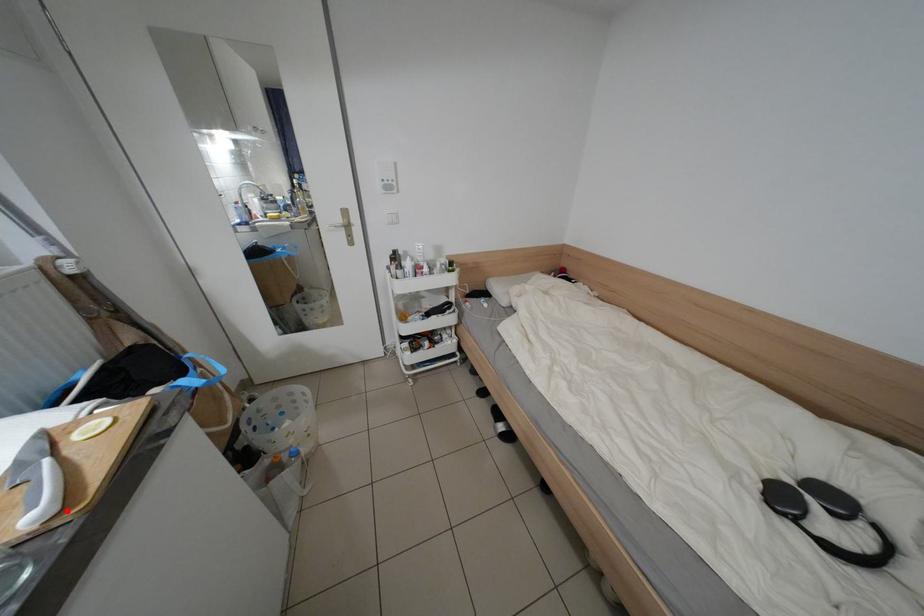
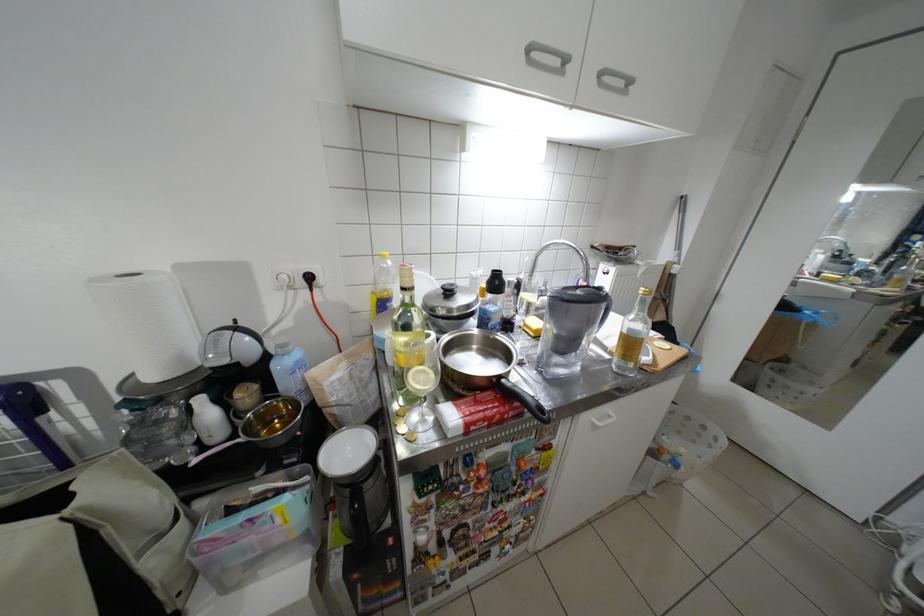
Question: I am providing you with two images of the same scene from different viewpoints. A red point is marked on the first image. Is the red point's position out of view in image 2?

Choices:
 (A) Yes
 (B) No

Answer: (B)